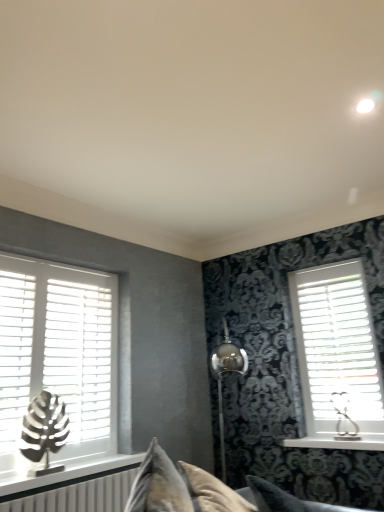
Question: Should I look upward or downward to see velvet beige couch at center?

Choices:
 (A) down
 (B) up

Answer: (A)

Question: Does white matte shutter at left lie behind white wood window sill at right?

Choices:
 (A) yes
 (B) no

Answer: (B)

Question: Is white wood window sill at right surrounded by white matte shutter at left?

Choices:
 (A) yes
 (B) no

Answer: (B)

Question: Is white matte shutter at left shorter than white wood window sill at right?

Choices:
 (A) no
 (B) yes

Answer: (A)

Question: Is there a large distance between white matte shutter at left and white wood window sill at right?

Choices:
 (A) no
 (B) yes

Answer: (B)

Question: Is white matte shutter at left positioned before white wood window sill at right?

Choices:
 (A) yes
 (B) no

Answer: (A)

Question: Is white matte shutter at left next to white wood window sill at right?

Choices:
 (A) yes
 (B) no

Answer: (B)

Question: Is the position of metallic leaf sculpture at left, marked as the second table lamp in a back-to-front arrangement, more distant than that of white wood blinds at left, which appears as the 2th window when viewed from the right?

Choices:
 (A) yes
 (B) no

Answer: (B)

Question: Can you see metallic leaf sculpture at left, marked as the second table lamp in a back-to-front arrangement, touching white wood blinds at left, which appears as the 1th window when viewed from the left?

Choices:
 (A) yes
 (B) no

Answer: (B)

Question: From the image's perspective, is metallic leaf sculpture at left, the 1th table lamp in the front-to-back sequence, below white wood blinds at left, which appears as the 2th window when viewed from the right?

Choices:
 (A) yes
 (B) no

Answer: (A)

Question: Could you tell me if metallic leaf sculpture at left, positioned as the first table lamp in left-to-right order, is facing white wood blinds at left, which appears as the 1th window when viewed from the left?

Choices:
 (A) yes
 (B) no

Answer: (B)

Question: From a real-world perspective, does metallic leaf sculpture at left, the 1th table lamp in the front-to-back sequence, stand above white wood blinds at left, which appears as the 2th window when viewed from the right?

Choices:
 (A) yes
 (B) no

Answer: (B)

Question: Does metallic leaf sculpture at left, the 2th table lamp when ordered from right to left, have a greater height compared to white wood blinds at left, which appears as the 1th window when viewed from the left?

Choices:
 (A) yes
 (B) no

Answer: (B)

Question: Is velvet gray pillow at lower center next to velvet beige couch at center?

Choices:
 (A) no
 (B) yes

Answer: (A)